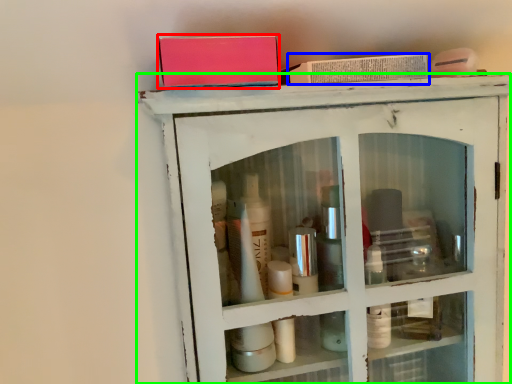
Question: Based on their relative distances, which object is farther from book (highlighted by a red box)? Choose from book (highlighted by a blue box) and shelf (highlighted by a green box).

Choices:
 (A) book
 (B) shelf

Answer: (B)